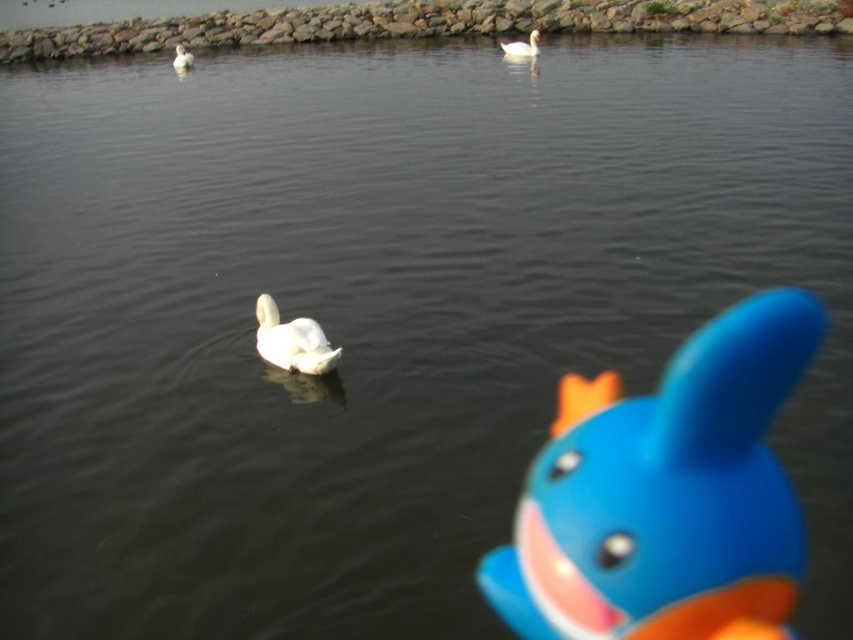
You are a photographer trying to capture a shot of the blue rubber duck at right and the white matte swan at center. If you want to frame both subjects so that the duck is in the foreground and the swan is in the background, would their current positions allow this?

Yes, the blue rubber duck at right is below the white matte swan at center, meaning the duck is closer to the viewer and the swan is further away, which allows for the desired framing with the duck in the foreground and the swan in the background.

You are standing at the center of the image. The blue rubber duck at right is located at coordinates. Which direction should you move to reach it?

The blue rubber duck at right is located at coordinates point (x=665, y=493). Since you are at the center, you should move towards the lower right direction to reach it.